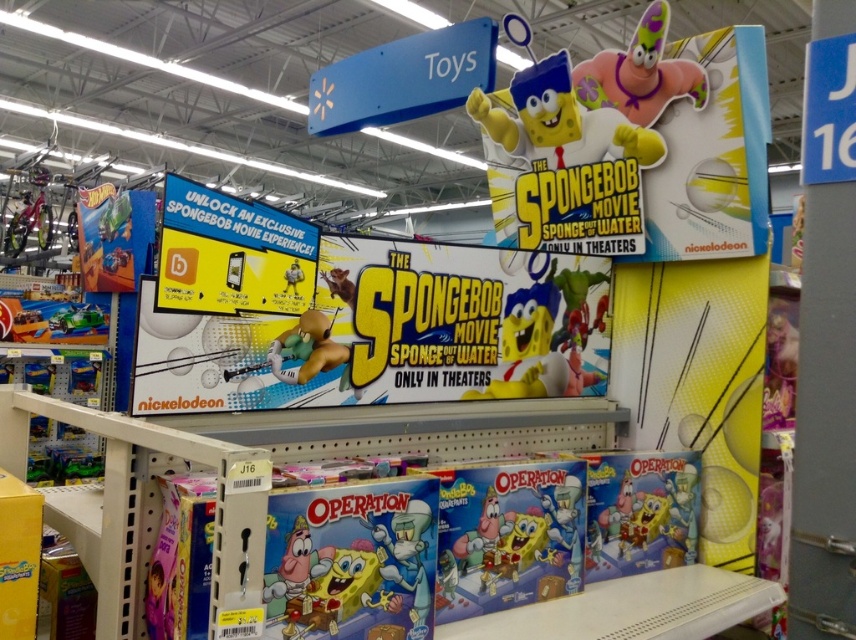
Based on the photo, you are standing in front of the SpongeBob Movie display at Walmart. You see a point marked at coordinates point [640,49]. If you want to reach that point with your hand, will you be able to touch it?

The point [640,49] is 7.03 feet away from the camera. Since the average human arm length is about 2.5 feet, you cannot reach it with your hand.

You are a customer in the Walmart toy section looking for a SpongeBob toy. You see the purple rubber patrick at upper right and the matte green toy at lower left. Which one is farther from the blue sign above the shelving unit?

The purple rubber patrick at upper right is farther from the blue sign above the shelving unit than the matte green toy at lower left because the purple rubber patrick at upper right is 10.40 feet away from the matte green toy at lower left, implying that the upper right object is further away from the sign.

You are a customer looking for a toy car to buy. You see the matte green car at left and the matte plastic toy at lower left. Which one is more to the left?

The matte green car at left is positioned on the left side of matte plastic toy at lower left, so it is more to the left.